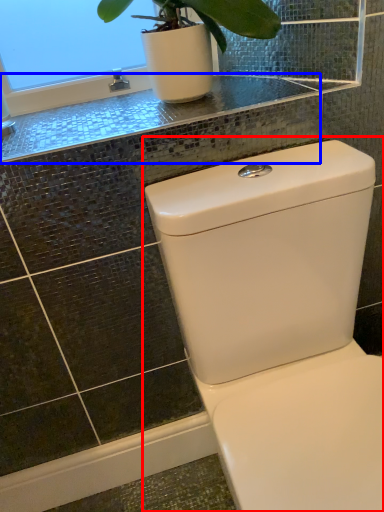
Question: Among these objects, which one is farthest to the camera, toilet (highlighted by a red box) or counter top (highlighted by a blue box)?

Choices:
 (A) toilet
 (B) counter top

Answer: (B)